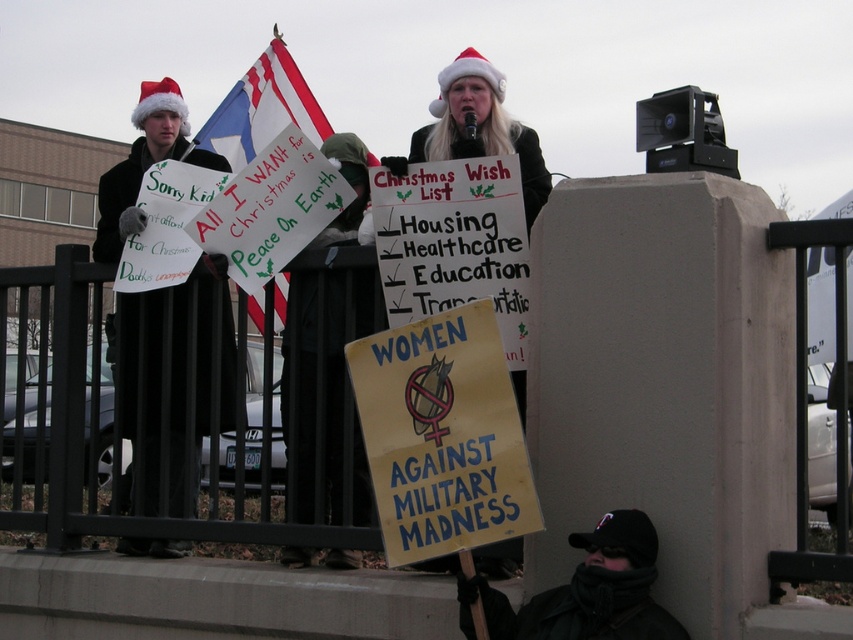
Question: Among these objects, which one is nearest to the camera?

Choices:
 (A) american flag at upper center
 (B) black fabric cape at center
 (C) american flag at center
 (D) black woolen hat at lower right

Answer: (D)

Question: Estimate the real-world distances between objects in this image. Which object is farther from the american flag at upper center?

Choices:
 (A) black fabric santa hat at left
 (B) black fabric cape at center
 (C) american flag at center

Answer: (B)

Question: Is black fabric santa hat at left wider than american flag at upper center?

Choices:
 (A) no
 (B) yes

Answer: (B)

Question: Does black woolen hat at lower right appear on the left side of american flag at center?

Choices:
 (A) no
 (B) yes

Answer: (A)

Question: Is black fabric santa hat at left to the right of black metal fence at lower left from the viewer's perspective?

Choices:
 (A) no
 (B) yes

Answer: (A)

Question: Which object is the farthest from the black metal fence at lower left?

Choices:
 (A) american flag at center
 (B) black woolen hat at lower right
 (C) black fabric cape at center

Answer: (A)